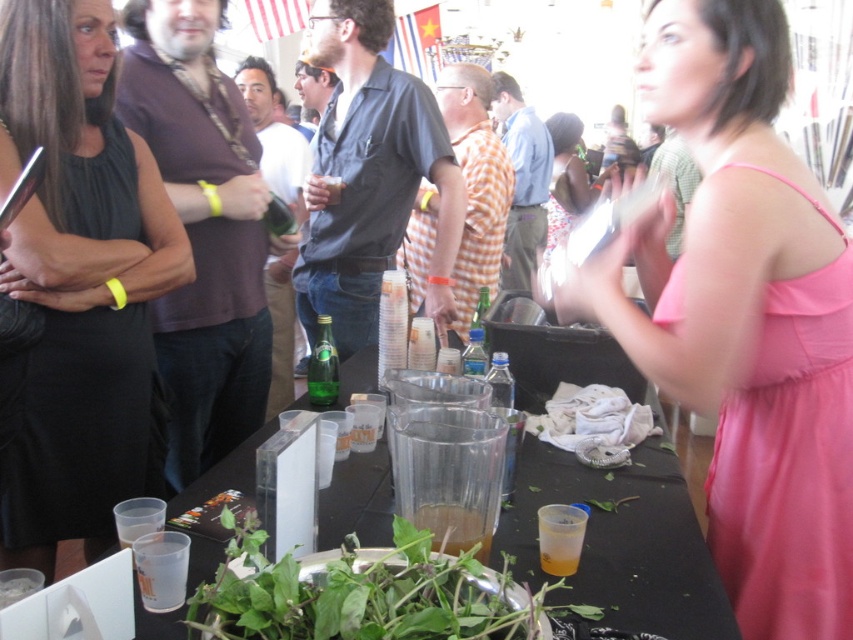
Which is above, pink satin dress at center or translucent plastic cup at lower center?

pink satin dress at center is higher up.

Identify the location of pink satin dress at center. click(x=567, y=179).

Identify the location of pink satin dress at center. The width and height of the screenshot is (853, 640). (567, 179).

Between green leafy vegetable at center and translucent plastic cup at center, which one has less height?

With less height is translucent plastic cup at center.

Between green leafy vegetable at center and translucent plastic cup at center, which one has more height?

green leafy vegetable at center is taller.

Who is more distant from viewer, (x=397, y=536) or (x=440, y=504)?

The point (x=440, y=504) is more distant.

Locate an element on the screen. green leafy vegetable at center is located at coordinates (360, 595).

Which of these two, clear plastic cup at lower left or translucent plastic cup at lower center, stands shorter?

translucent plastic cup at lower center

Does point (167, 595) come farther from viewer compared to point (564, 522)?

No, it is in front of (564, 522).

The image size is (853, 640). I want to click on clear plastic cup at lower left, so click(x=161, y=570).